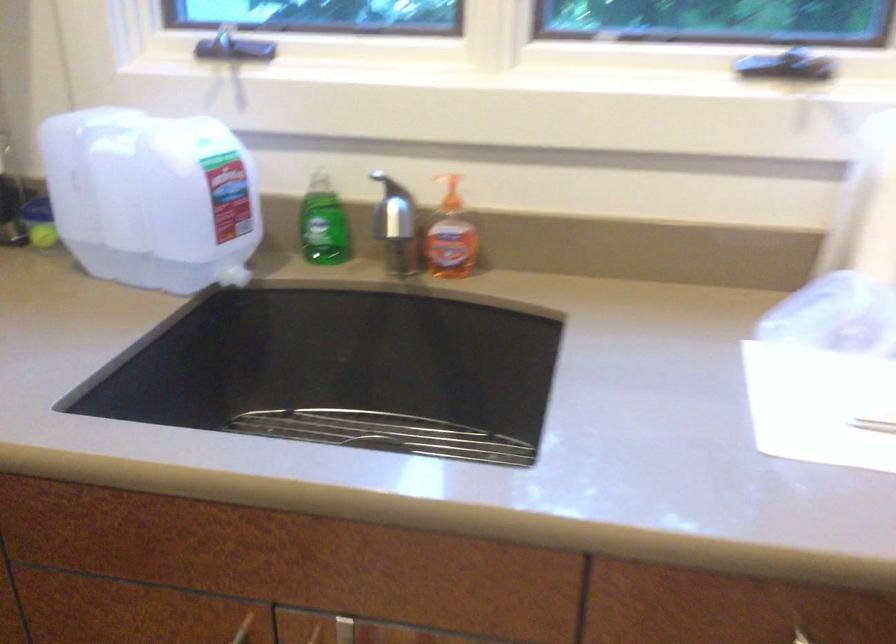
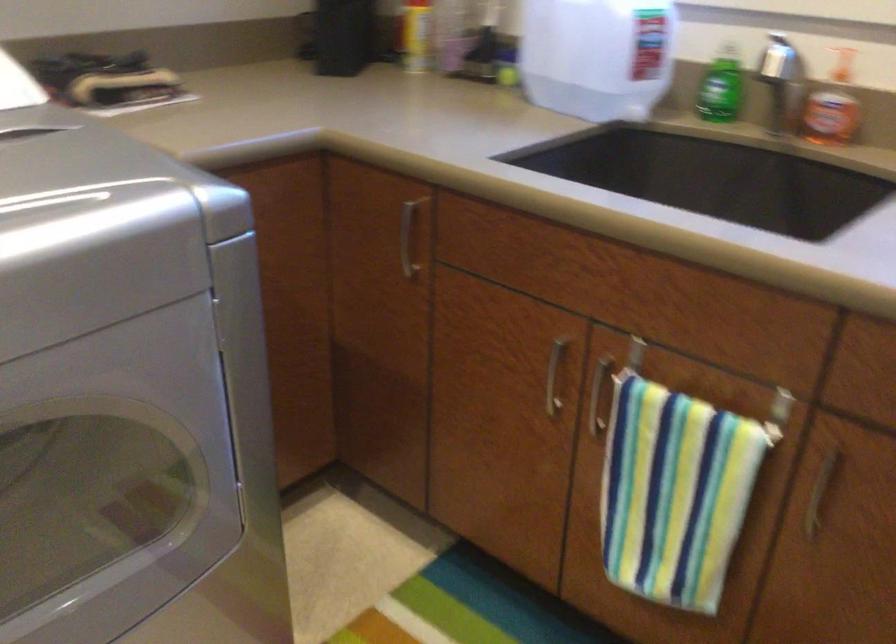
Question: I am providing you with two images of the same scene from different viewpoints. Please identify which objects are invisible in image2.

Choices:
 (A) silver plant pot
 (B) silver faucet handle
 (C) metal sink rack
 (D) orange soap bottle

Answer: (C)